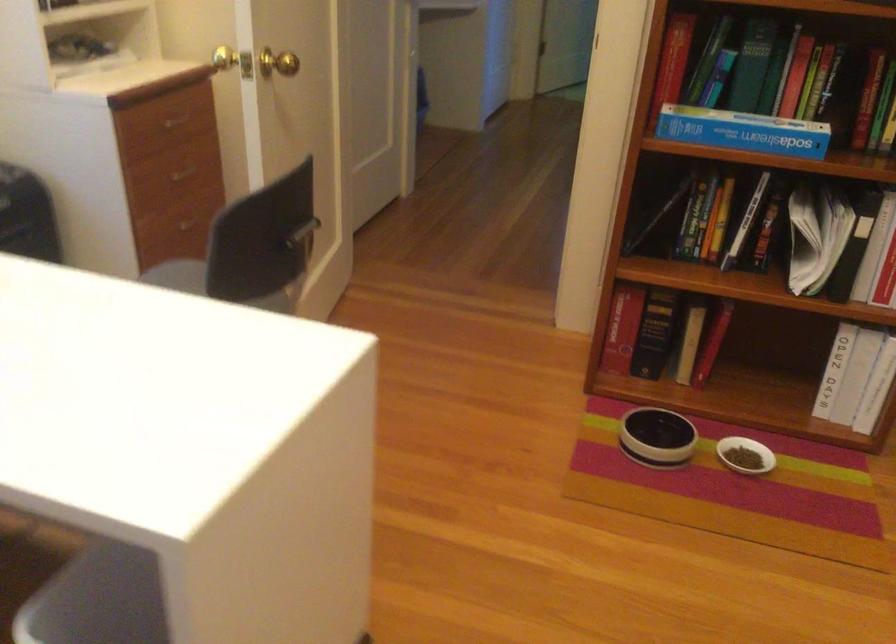
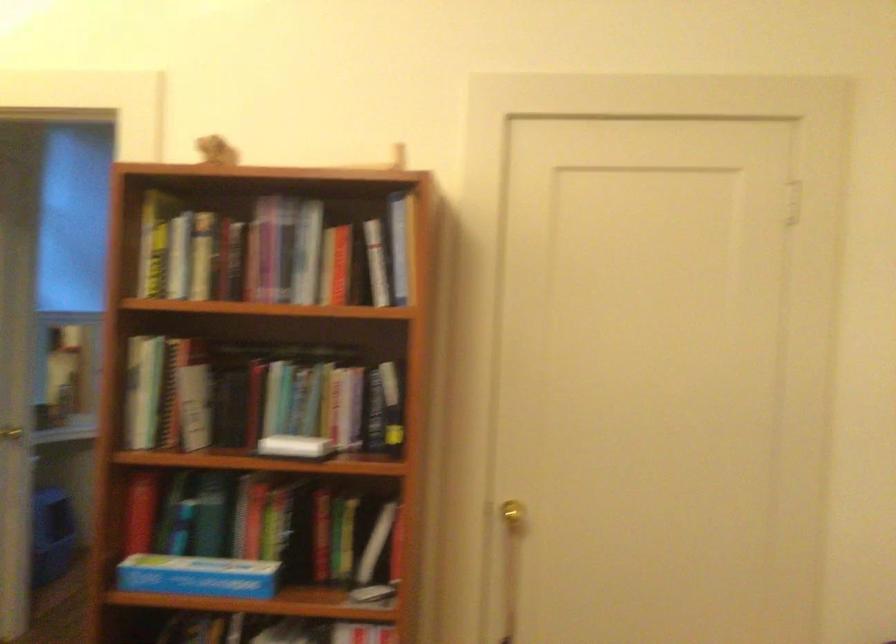
The first image is from the beginning of the video and the second image is from the end. How did the camera likely rotate when shooting the video?

The rotation direction of the camera is right-up.